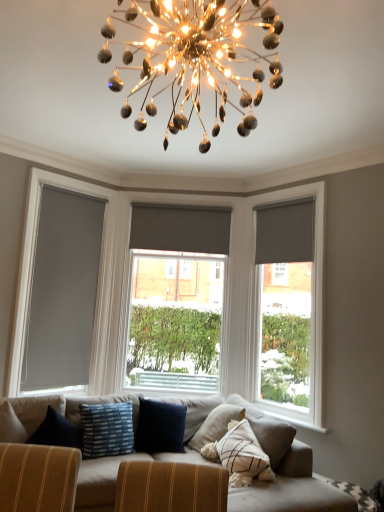
Question: Does matte gray roller blind at center, which is the 1th window from left to right, have a smaller size compared to matte gray roller blind at left?

Choices:
 (A) yes
 (B) no

Answer: (B)

Question: Considering the relative positions of matte gray roller blind at center, which is the 1th window from left to right, and matte gray roller blind at left in the image provided, is matte gray roller blind at center, which is the 1th window from left to right, to the left of matte gray roller blind at left from the viewer's perspective?

Choices:
 (A) yes
 (B) no

Answer: (B)

Question: From a real-world perspective, is matte gray roller blind at center, which is the 1th window from left to right, on matte gray roller blind at left?

Choices:
 (A) yes
 (B) no

Answer: (B)

Question: Is matte gray roller blind at center, placed as the 2th window when sorted from right to left, looking in the opposite direction of matte gray roller blind at left?

Choices:
 (A) no
 (B) yes

Answer: (A)

Question: Are matte gray roller blind at center, which is the 1th window from left to right, and matte gray roller blind at left located far from each other?

Choices:
 (A) yes
 (B) no

Answer: (A)

Question: Does matte gray roller blind at center, which is the 1th window from left to right, appear on the right side of matte gray roller blind at left?

Choices:
 (A) no
 (B) yes

Answer: (B)

Question: Considering the relative positions of matte gray roller blind at right, placed as the 2th curtain when sorted from back to front, and shiny metallic chandelier at upper center in the image provided, is matte gray roller blind at right, placed as the 2th curtain when sorted from back to front, to the right of shiny metallic chandelier at upper center from the viewer's perspective?

Choices:
 (A) no
 (B) yes

Answer: (B)

Question: Could you tell me if matte gray roller blind at right, positioned as the first curtain in right-to-left order, is facing shiny metallic chandelier at upper center?

Choices:
 (A) yes
 (B) no

Answer: (B)

Question: Is matte gray roller blind at right, placed as the 2th curtain when sorted from back to front, far away from shiny metallic chandelier at upper center?

Choices:
 (A) no
 (B) yes

Answer: (B)

Question: Is matte gray roller blind at right, positioned as the first curtain in right-to-left order, at the left side of shiny metallic chandelier at upper center?

Choices:
 (A) no
 (B) yes

Answer: (A)

Question: From a real-world perspective, is matte gray roller blind at right, positioned as the first curtain in right-to-left order, located beneath shiny metallic chandelier at upper center?

Choices:
 (A) yes
 (B) no

Answer: (B)

Question: Is matte gray roller blind at right, the first curtain positioned from the front, bigger than shiny metallic chandelier at upper center?

Choices:
 (A) yes
 (B) no

Answer: (B)

Question: Is matte gray roller blind at center, placed as the 2th window when sorted from right to left, inside shiny metallic chandelier at upper center?

Choices:
 (A) yes
 (B) no

Answer: (B)